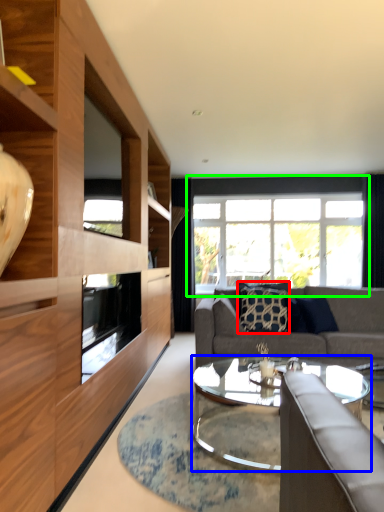
Question: Which is farther away from pillow (highlighted by a red box)? coffee table (highlighted by a blue box) or window (highlighted by a green box)?

Choices:
 (A) coffee table
 (B) window

Answer: (B)